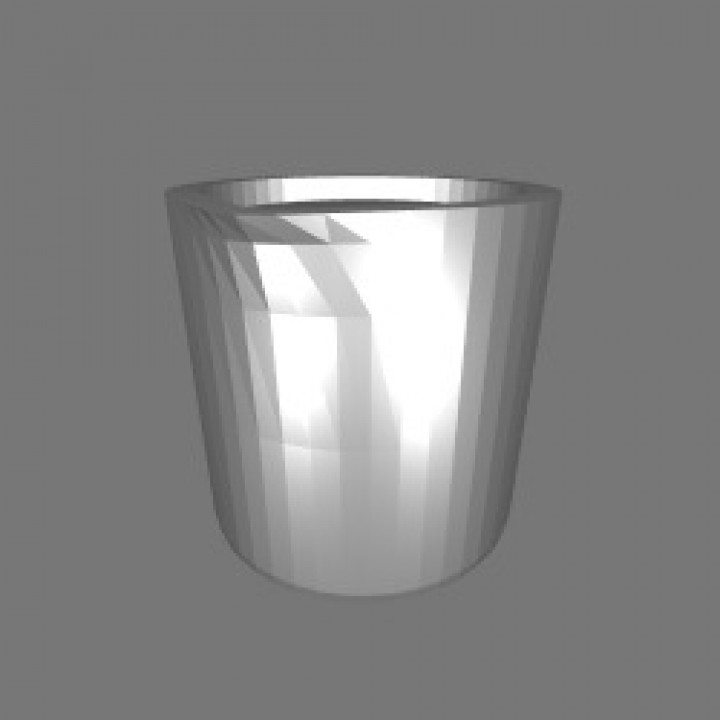
In order to click on 3d model of a pot or bin in this screenshot , I will do `click(358, 355)`.